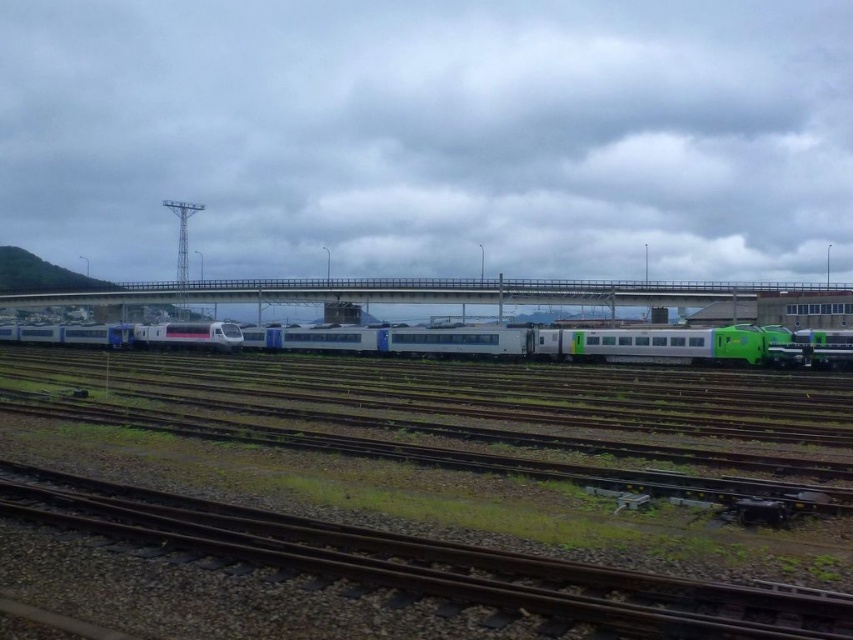
Is point (233, 538) less distant than point (370, 285)?

Yes, it is.

Locate an element on the screen. The width and height of the screenshot is (853, 640). brown gravel train track at lower center is located at coordinates (426, 563).

Consider the image. Can you confirm if white glossy train at center is smaller than concrete bridge at center?

Indeed, white glossy train at center has a smaller size compared to concrete bridge at center.

Locate an element on the screen. The image size is (853, 640). white glossy train at center is located at coordinates (577, 342).

Does point (524, 339) come in front of point (509, 292)?

Yes, point (524, 339) is in front of point (509, 292).

Image resolution: width=853 pixels, height=640 pixels. I want to click on white glossy train at center, so click(577, 342).

Is point (732, 584) positioned in front of point (491, 333)?

Yes.

Who is lower down, brown gravel train track at lower center or white glossy train at center?

Positioned lower is brown gravel train track at lower center.

I want to click on brown gravel train track at lower center, so click(426, 563).